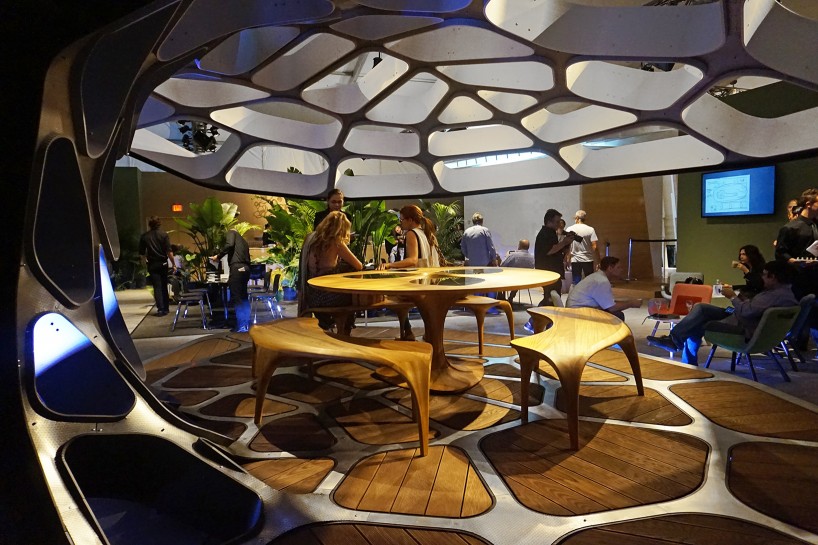
Where is `white design weaving throughout wooden floor area`? The height and width of the screenshot is (545, 818). white design weaving throughout wooden floor area is located at coordinates (509, 529), (497, 481), (717, 496), (677, 398), (501, 362), (171, 377), (302, 411), (234, 391), (244, 440), (322, 499).